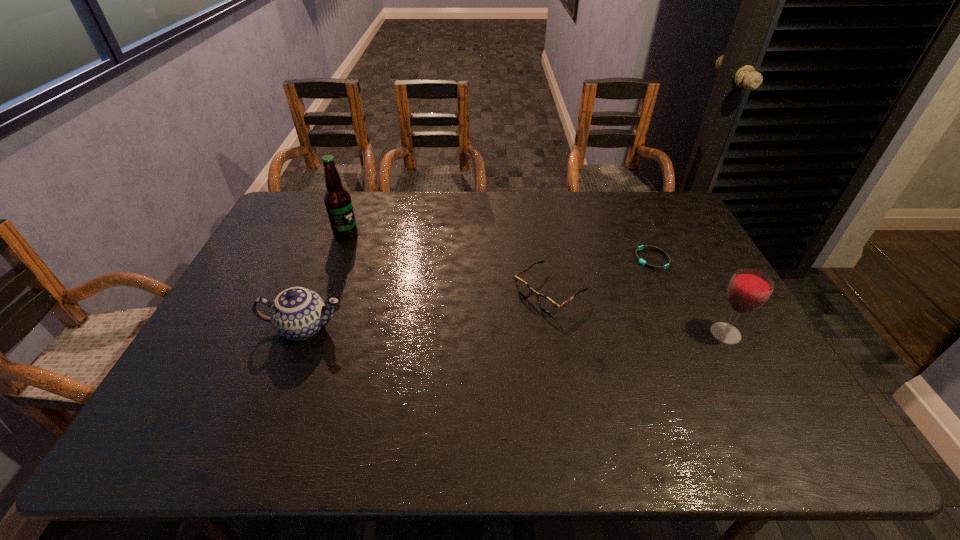
Find the location of a particular element. This screenshot has width=960, height=540. blank area located on the left of the second tallest object is located at coordinates (560, 334).

Where is `free space located 0.110m on the buckle of the fourth object from left to right`? free space located 0.110m on the buckle of the fourth object from left to right is located at coordinates (621, 282).

At what (x,y) coordinates should I click in order to perform the action: click on vacant space situated on the buckle of the fourth object from left to right. Please return your answer as a coordinate pair (x, y). The image size is (960, 540). Looking at the image, I should click on (585, 309).

Locate an element on the screen. The image size is (960, 540). free spot located on the buckle of the fourth object from left to right is located at coordinates (634, 273).

The height and width of the screenshot is (540, 960). I want to click on vacant space situated 0.380m on the frame of the second shortest object, so click(413, 389).

Locate an element on the screen. Image resolution: width=960 pixels, height=540 pixels. vacant space positioned on the frame of the second shortest object is located at coordinates (x=485, y=338).

Where is `vacant point located 0.180m on the frame of the second shortest object`? Image resolution: width=960 pixels, height=540 pixels. vacant point located 0.180m on the frame of the second shortest object is located at coordinates (476, 344).

At what (x,y) coordinates should I click in order to perform the action: click on vacant space situated on the label of the farthest object. Please return your answer as a coordinate pair (x, y). The height and width of the screenshot is (540, 960). Looking at the image, I should click on (434, 299).

This screenshot has height=540, width=960. In order to click on vacant space located 0.390m on the label of the farthest object in this screenshot , I will do `click(431, 296)`.

Image resolution: width=960 pixels, height=540 pixels. I want to click on blank area located 0.390m on the label of the farthest object, so click(431, 296).